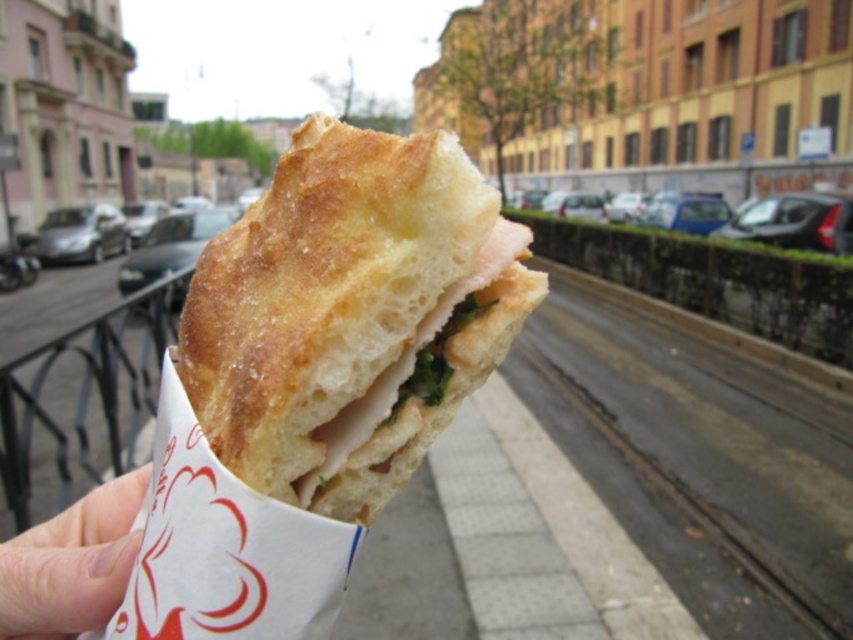
You are a delivery person holding the sandwich and need to place it on the dark gray concrete train track at lower center. Can you fit the golden brown crusty bread at center on top of it without overlapping the edges?

The golden brown crusty bread at center has a lesser height compared to dark gray concrete train track at lower center, so it can be placed on top without overlapping the edges.

You are standing in the street scene shown in the image and want to walk towards the sandwich. Which of the two points, point (405, 410) or point (653, 460), is closer to your current position?

Point (405, 410) is closer to the camera than point (653, 460), so you are closer to point (405, 410) when standing in the street scene.

You are a food delivery person holding a sandwich. You notice the golden brown crusty bread at center and the pale skin at lower left in your view. Which object is located to the right of the other?

The golden brown crusty bread at center is positioned on the right side of pale skin at lower left.